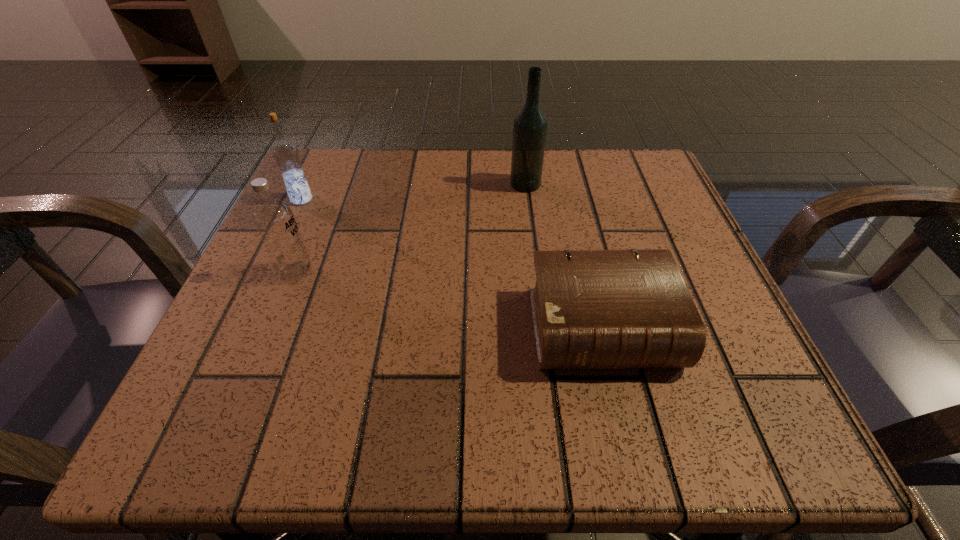
In the image, there is a desktop. Where is `vacant space at the far edge`? The image size is (960, 540). vacant space at the far edge is located at coordinates (556, 184).

This screenshot has width=960, height=540. Identify the location of vacant space at the near edge of the desktop. point(601,449).

At what (x,y) coordinates should I click in order to perform the action: click on vacant space at the left edge. Please return your answer as a coordinate pair (x, y). The height and width of the screenshot is (540, 960). Looking at the image, I should click on (255, 368).

Where is `free space at the right edge of the desktop`? This screenshot has width=960, height=540. free space at the right edge of the desktop is located at coordinates (628, 237).

Where is `free region at the far left corner of the desktop`? The width and height of the screenshot is (960, 540). free region at the far left corner of the desktop is located at coordinates (363, 182).

I want to click on free space at the near left corner of the desktop, so click(x=188, y=392).

Locate an element on the screen. blank space at the far right corner is located at coordinates (603, 154).

You are a GUI agent. You are given a task and a screenshot of the screen. Output one action in this format:
    pyautogui.click(x=<x>, y=<y>)
    Task: Click on the vacant space at the near right corner
    
    Given the screenshot: What is the action you would take?
    tap(707, 390)

The height and width of the screenshot is (540, 960). What are the coordinates of `empty space that is in between the Bible and the second nearest object` in the screenshot? It's located at (449, 300).

Identify the location of unoccupied position between the second nearest object and the Bible. coord(449,300).